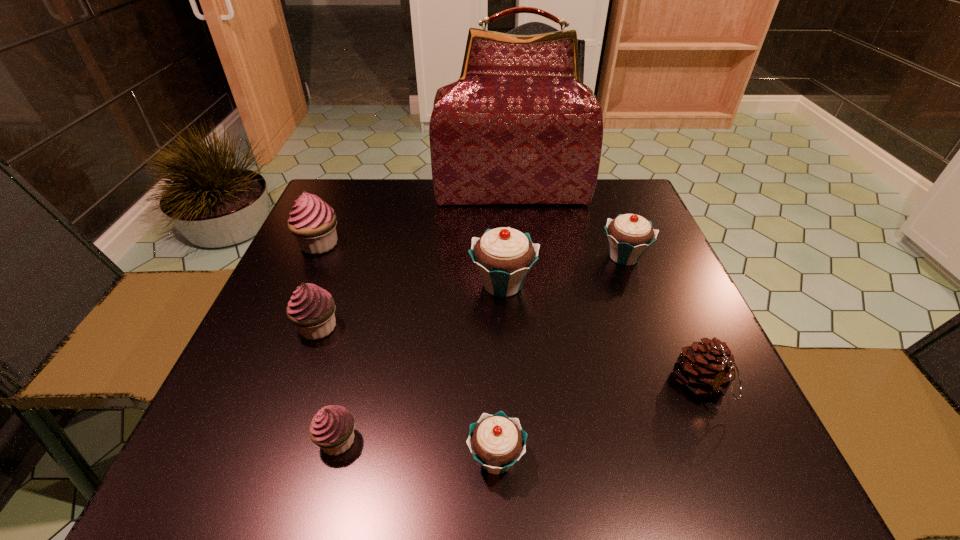
The image size is (960, 540). What are the coordinates of `vacant space that satisfies the following two spatial constraints: 1. on the front-facing side of the farthest object; 2. on the left side of the rightmost cupcake` in the screenshot? It's located at [518, 256].